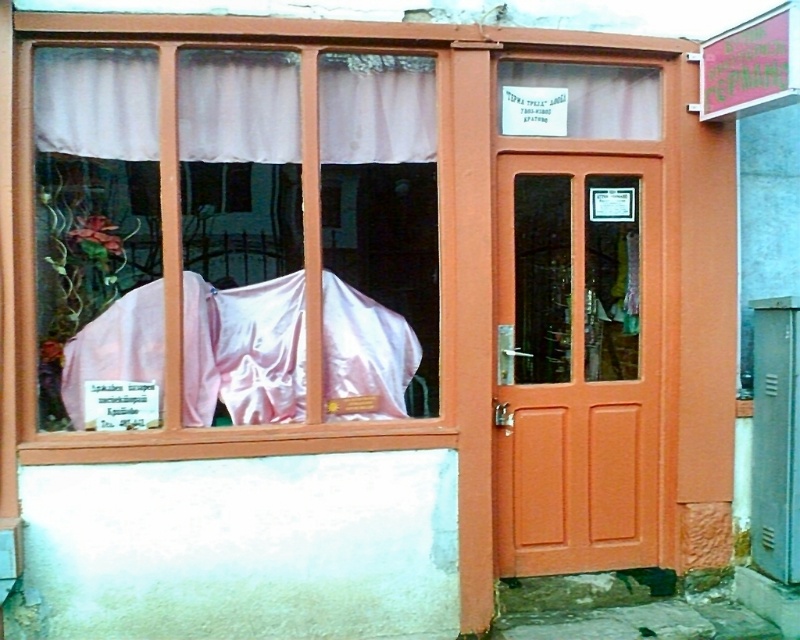
Question: Which is farther from the pink satin cloth at left?

Choices:
 (A) pink fabric at center
 (B) orange matte door at center
 (C) white sheer curtain at upper left

Answer: (B)

Question: Among these objects, which one is nearest to the camera?

Choices:
 (A) white sheer curtain at upper left
 (B) pink satin cloth at left
 (C) pink fabric at center
 (D) orange matte door at center

Answer: (B)

Question: Is white sheer curtain at upper left further to camera compared to pink fabric at center?

Choices:
 (A) yes
 (B) no

Answer: (B)

Question: Can you confirm if pink satin cloth at left is positioned to the right of pink fabric at center?

Choices:
 (A) yes
 (B) no

Answer: (A)

Question: Is orange matte door at center further to the viewer compared to pink fabric at center?

Choices:
 (A) yes
 (B) no

Answer: (A)

Question: Among these objects, which one is farthest from the camera?

Choices:
 (A) pink fabric at center
 (B) orange matte door at center
 (C) white sheer curtain at upper left
 (D) pink satin cloth at left

Answer: (B)